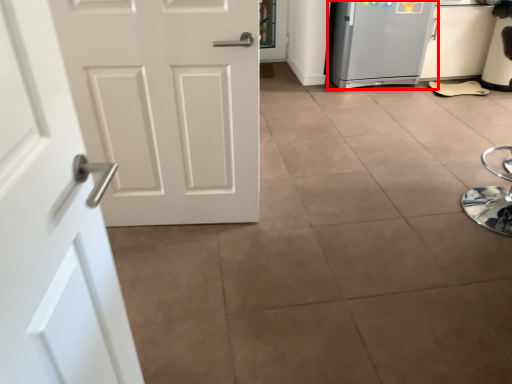
Question: From the image, what is the correct spatial relationship of refrigerator (annotated by the red box) in relation to door?

Choices:
 (A) right
 (B) left

Answer: (A)